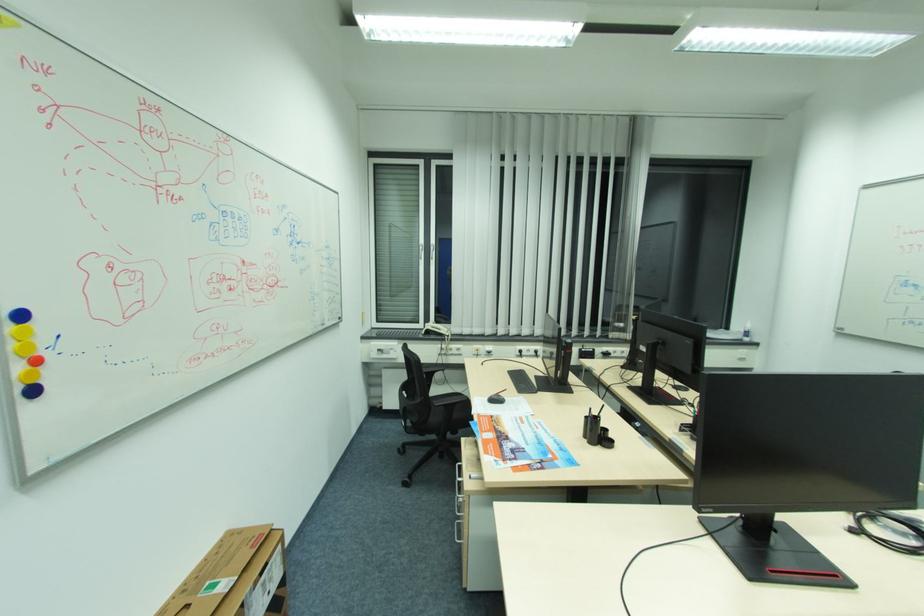
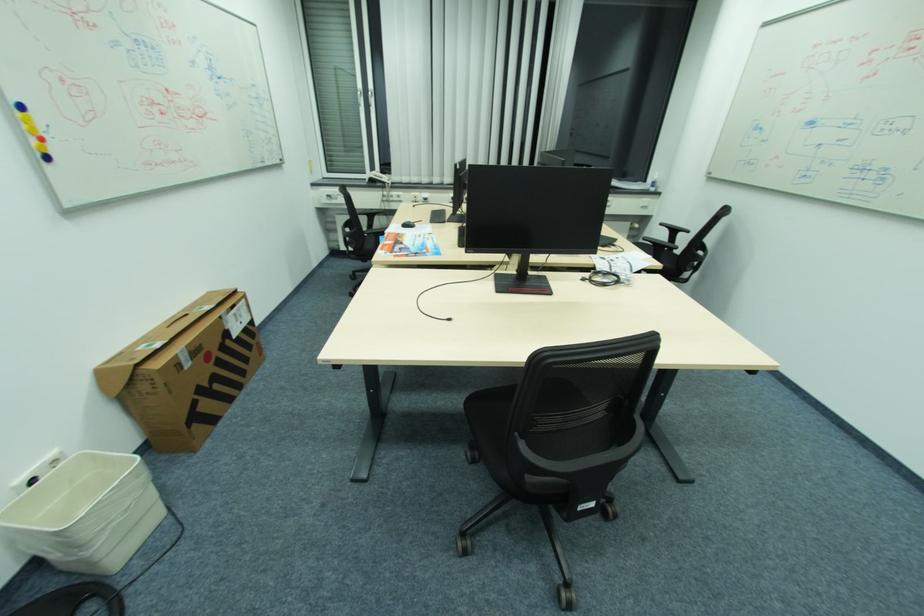
Find the pixel in the second image that matches the point at 39,392 in the first image.

(52, 158)